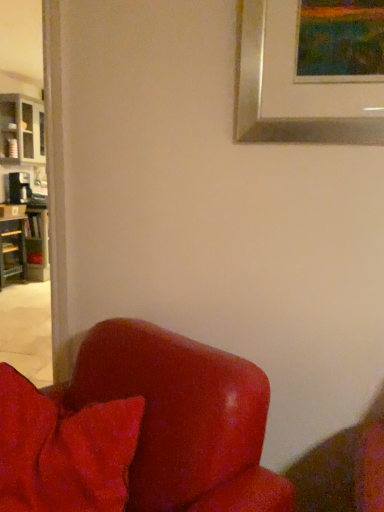
Question: Is wooden bookshelf at left positioned far away from velvety red pillow at lower left?

Choices:
 (A) no
 (B) yes

Answer: (B)

Question: Is wooden bookshelf at left oriented towards velvety red pillow at lower left?

Choices:
 (A) yes
 (B) no

Answer: (B)

Question: Does wooden bookshelf at left have a greater height compared to velvety red pillow at lower left?

Choices:
 (A) yes
 (B) no

Answer: (A)

Question: Is wooden bookshelf at left smaller than velvety red pillow at lower left?

Choices:
 (A) no
 (B) yes

Answer: (A)

Question: From the image's perspective, would you say wooden bookshelf at left is positioned over velvety red pillow at lower left?

Choices:
 (A) yes
 (B) no

Answer: (A)

Question: Would you say satin red armchair at lower left is to the left or to the right of matte gray cabinet at left in the picture?

Choices:
 (A) right
 (B) left

Answer: (A)

Question: From the image's perspective, relative to matte gray cabinet at left, is satin red armchair at lower left above or below?

Choices:
 (A) above
 (B) below

Answer: (B)

Question: In the image, is satin red armchair at lower left positioned in front of or behind matte gray cabinet at left?

Choices:
 (A) front
 (B) behind

Answer: (A)

Question: From their relative heights in the image, would you say satin red armchair at lower left is taller or shorter than matte gray cabinet at left?

Choices:
 (A) short
 (B) tall

Answer: (A)

Question: Is point pos(14,220) closer or farther from the camera than point pos(102,378)?

Choices:
 (A) closer
 (B) farther

Answer: (B)

Question: From the image's perspective, is wooden bookshelf at left located above or below satin red armchair at lower left?

Choices:
 (A) below
 (B) above

Answer: (B)

Question: From a real-world perspective, relative to satin red armchair at lower left, is wooden bookshelf at left vertically above or below?

Choices:
 (A) above
 (B) below

Answer: (B)

Question: From their relative heights in the image, would you say wooden bookshelf at left is taller or shorter than satin red armchair at lower left?

Choices:
 (A) tall
 (B) short

Answer: (B)

Question: Based on their sizes in the image, would you say satin red armchair at lower left is bigger or smaller than wooden bookshelf at left?

Choices:
 (A) big
 (B) small

Answer: (A)

Question: Considering the positions of satin red armchair at lower left and wooden bookshelf at left in the image, is satin red armchair at lower left wider or thinner than wooden bookshelf at left?

Choices:
 (A) wide
 (B) thin

Answer: (A)